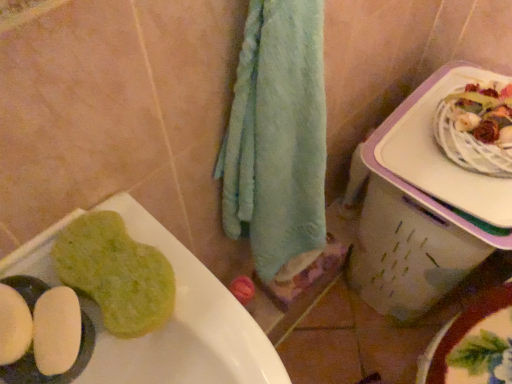
Question: Is green sponge at lower left looking in the opposite direction of white plastic lunch box at right?

Choices:
 (A) no
 (B) yes

Answer: (A)

Question: Considering the relative sizes of green sponge at lower left and white plastic lunch box at right in the image provided, is green sponge at lower left smaller than white plastic lunch box at right?

Choices:
 (A) no
 (B) yes

Answer: (B)

Question: Would you say green sponge at lower left is a long distance from white plastic lunch box at right?

Choices:
 (A) yes
 (B) no

Answer: (B)

Question: Could you tell me if green sponge at lower left is turned towards white plastic lunch box at right?

Choices:
 (A) no
 (B) yes

Answer: (A)

Question: Considering the relative positions of green sponge at lower left and white plastic lunch box at right in the image provided, is green sponge at lower left to the left of white plastic lunch box at right from the viewer's perspective?

Choices:
 (A) no
 (B) yes

Answer: (B)

Question: Considering the positions of green sponge at lower left and white plastic lunch box at right in the image, is green sponge at lower left taller or shorter than white plastic lunch box at right?

Choices:
 (A) tall
 (B) short

Answer: (B)

Question: Is green sponge at lower left wider or thinner than white plastic lunch box at right?

Choices:
 (A) thin
 (B) wide

Answer: (A)

Question: In the image, is green sponge at lower left positioned in front of or behind white plastic lunch box at right?

Choices:
 (A) behind
 (B) front

Answer: (B)

Question: Based on their positions, is green sponge at lower left located to the left or right of white plastic lunch box at right?

Choices:
 (A) right
 (B) left

Answer: (B)

Question: Does point (97, 367) appear closer or farther from the camera than point (355, 243)?

Choices:
 (A) closer
 (B) farther

Answer: (A)

Question: In the image, is green sponge at lower left positioned in front of or behind white plastic lunch box at right?

Choices:
 (A) behind
 (B) front

Answer: (B)

Question: Do you think green sponge at lower left is within white plastic lunch box at right, or outside of it?

Choices:
 (A) inside
 (B) outside

Answer: (B)

Question: From the image's perspective, is green sponge at lower left located above or below white plastic lunch box at right?

Choices:
 (A) below
 (B) above

Answer: (A)

Question: Is white plastic lunch box at right taller or shorter than green sponge at lower left?

Choices:
 (A) short
 (B) tall

Answer: (B)

Question: Is point (424, 122) closer or farther from the camera than point (214, 370)?

Choices:
 (A) closer
 (B) farther

Answer: (B)